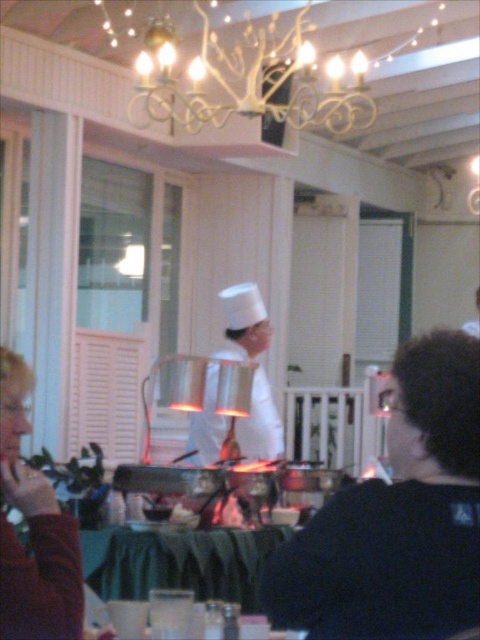
Which is more to the left, green fabric tablecloth at lower center or white matte chef hat at center?

green fabric tablecloth at lower center

Is green fabric tablecloth at lower center below white matte chef hat at center?

Yes, green fabric tablecloth at lower center is below white matte chef hat at center.

This screenshot has width=480, height=640. In order to click on green fabric tablecloth at lower center in this screenshot , I will do 180,561.

Locate an element on the screen. Image resolution: width=480 pixels, height=640 pixels. green fabric tablecloth at lower center is located at coordinates (180, 561).

Which is in front, point (11, 529) or point (250, 604)?

Point (11, 529) is more forward.

Does matte red sweater at lower left have a lesser width compared to green fabric tablecloth at lower center?

Yes, matte red sweater at lower left is thinner than green fabric tablecloth at lower center.

Find the location of a particular element. This screenshot has width=480, height=640. matte red sweater at lower left is located at coordinates (33, 531).

Between white chef hat at center and matte red sweater at lower left, which one has more height?

white chef hat at center

Is white chef hat at center thinner than matte red sweater at lower left?

No.

The width and height of the screenshot is (480, 640). What are the coordinates of `white chef hat at center` in the screenshot? It's located at (397, 516).